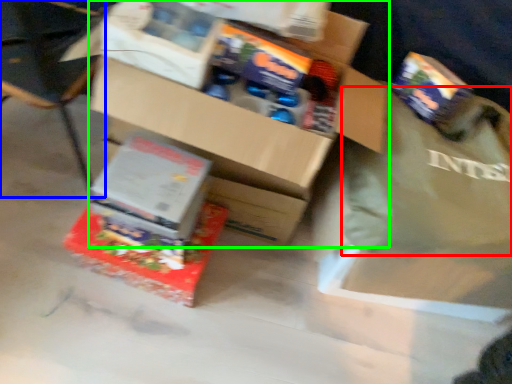
Question: Which is nearer to the tote bag (highlighted by a red box)? chair (highlighted by a blue box) or box (highlighted by a green box).

Choices:
 (A) chair
 (B) box

Answer: (B)